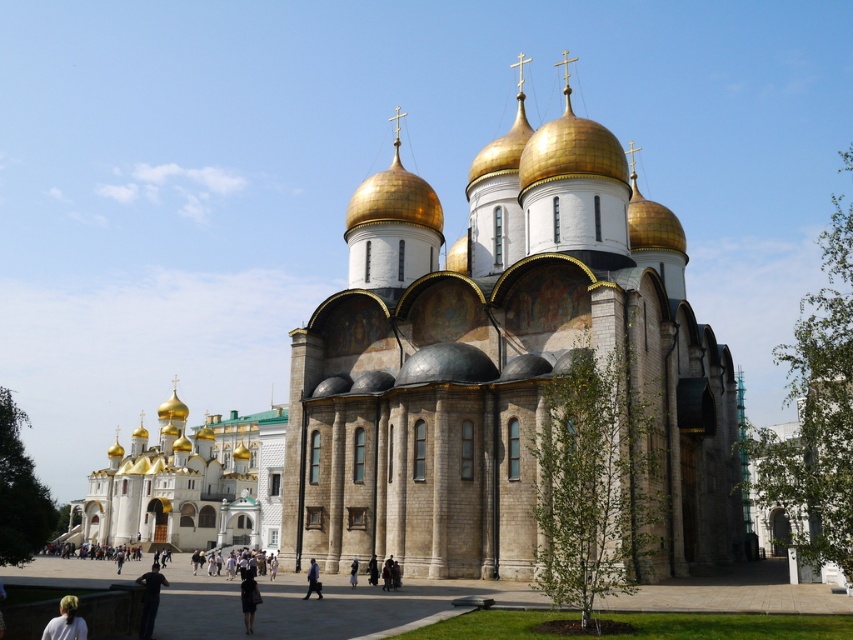
Is point (370, 433) closer to viewer compared to point (370, 556)?

No.

In the scene shown: Who is positioned more to the right, stone church at center or dark brown leather jacket at center?

Positioned to the right is stone church at center.

Is point (563, 252) positioned before point (375, 573)?

That is False.

At what (x,y) coordinates should I click in order to perform the action: click on stone church at center. Please return your answer as a coordinate pair (x, y). The width and height of the screenshot is (853, 640). Looking at the image, I should click on (502, 364).

Does dark blue dress at center have a lesser height compared to dark blue jeans at center?

Yes.

You are a GUI agent. You are given a task and a screenshot of the screen. Output one action in this format:
    pyautogui.click(x=<x>, y=<y>)
    Task: Click on the dark blue dress at center
    This screenshot has height=640, width=853.
    Given the screenshot: What is the action you would take?
    pyautogui.click(x=248, y=600)

Image resolution: width=853 pixels, height=640 pixels. In order to click on dark blue dress at center in this screenshot , I will do `click(248, 600)`.

Who is positioned more to the left, dark brown leather jacket at center or dark blue fabric at center?

Positioned to the left is dark blue fabric at center.

Locate an element on the screen. dark brown leather jacket at center is located at coordinates (372, 570).